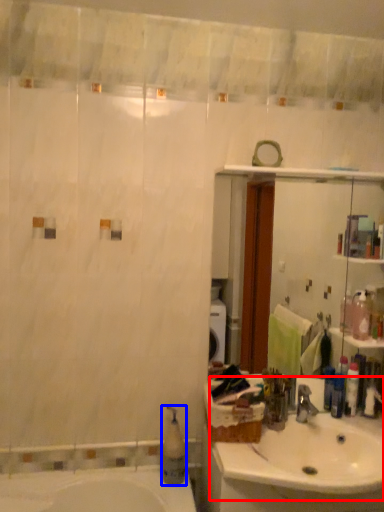
Question: Among these objects, which one is nearest to the camera, sink (highlighted by a red box) or soap dispenser (highlighted by a blue box)?

Choices:
 (A) sink
 (B) soap dispenser

Answer: (A)